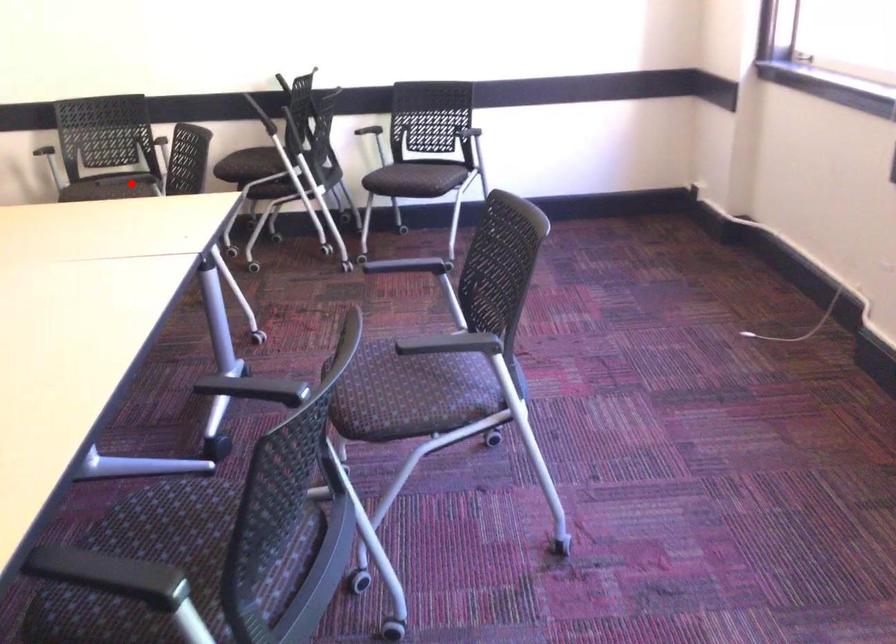
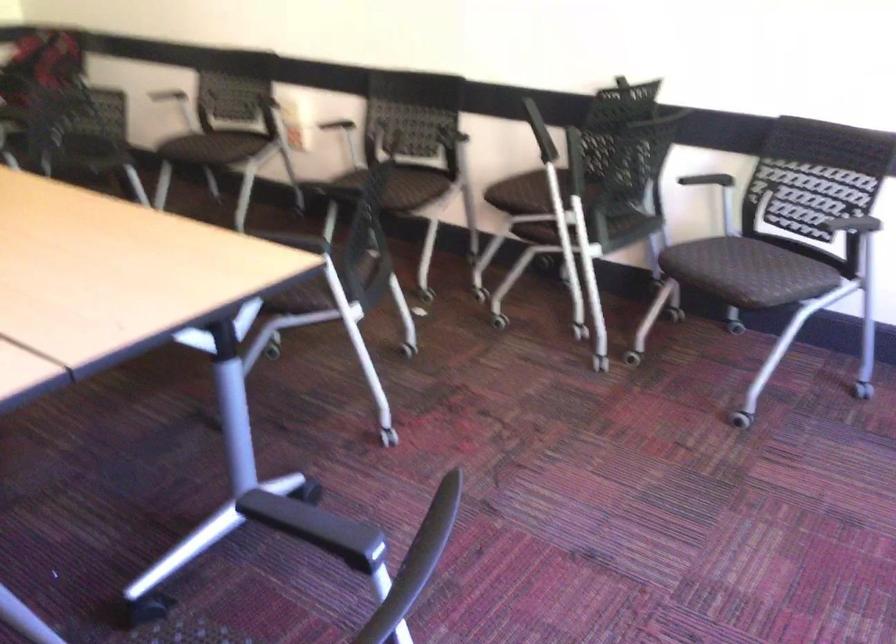
Question: I am providing you with two images of the same scene from different viewpoints. Image1 has a red point marked. In image2, the corresponding 3D location appears at what relative position? Reply with the corresponding letter.

Choices:
 (A) Closer
 (B) Farther

Answer: (A)